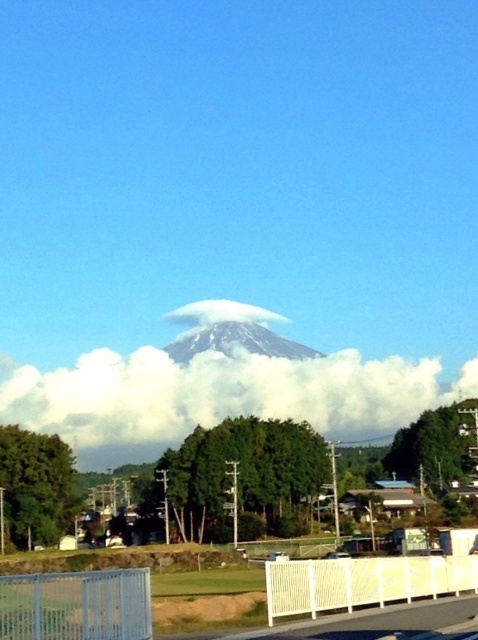
Question: Is white fluffy cloud at center below white snow-covered mountain at center?

Choices:
 (A) no
 (B) yes

Answer: (B)

Question: Which point is farther to the camera?

Choices:
 (A) white snow-covered mountain at center
 (B) white fluffy cloud at center

Answer: (A)

Question: Which point appears farthest from the camera in this image?

Choices:
 (A) (51, 420)
 (B) (212, 337)

Answer: (B)

Question: Does white fluffy cloud at center come in front of white snow-covered mountain at center?

Choices:
 (A) yes
 (B) no

Answer: (A)

Question: Among these objects, which one is farthest from the camera?

Choices:
 (A) white snow-covered mountain at center
 (B) white fluffy cloud at center

Answer: (A)

Question: Is white fluffy cloud at center thinner than white snow-covered mountain at center?

Choices:
 (A) no
 (B) yes

Answer: (A)